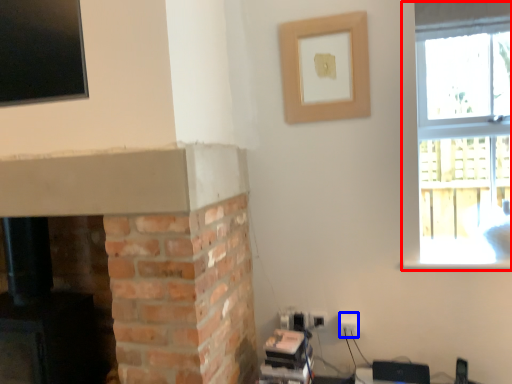
Question: Which point is closer to the camera, window (highlighted by a red box) or electric outlet (highlighted by a blue box)?

Choices:
 (A) window
 (B) electric outlet

Answer: (A)